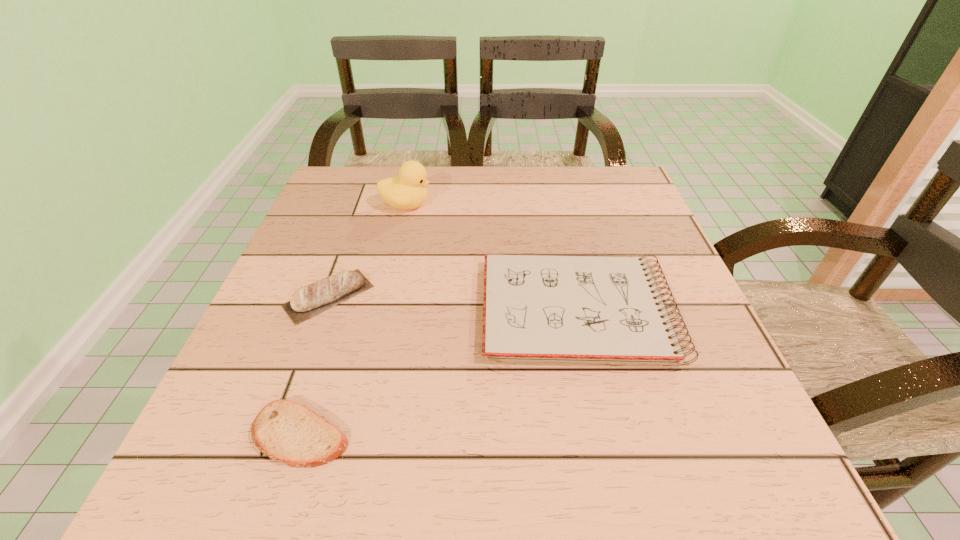
Where is `free space at the far right corner of the desktop`? The height and width of the screenshot is (540, 960). free space at the far right corner of the desktop is located at coordinates 599,212.

The width and height of the screenshot is (960, 540). I want to click on vacant area at the near right corner, so pyautogui.click(x=757, y=471).

Where is `vacant area that lies between the taller pita bread and the nearer pita bread`? Image resolution: width=960 pixels, height=540 pixels. vacant area that lies between the taller pita bread and the nearer pita bread is located at coordinates (315, 365).

I want to click on free space between the taller pita bread and the shorter pita bread, so click(x=315, y=365).

The height and width of the screenshot is (540, 960). I want to click on vacant area between the rightmost object and the taller pita bread, so click(x=453, y=303).

Where is `unoccupied area between the farthest object and the nearer pita bread`? This screenshot has height=540, width=960. unoccupied area between the farthest object and the nearer pita bread is located at coordinates (353, 320).

I want to click on free space between the nearest object and the farthest object, so click(x=353, y=320).

Where is `free space between the shorter pita bread and the notepad`? free space between the shorter pita bread and the notepad is located at coordinates (439, 372).

Image resolution: width=960 pixels, height=540 pixels. What are the coordinates of `unoccupied area between the farthest object and the farther pita bread` in the screenshot? It's located at (368, 251).

The width and height of the screenshot is (960, 540). What are the coordinates of `free space between the rightmost object and the farther pita bread` in the screenshot? It's located at (453, 303).